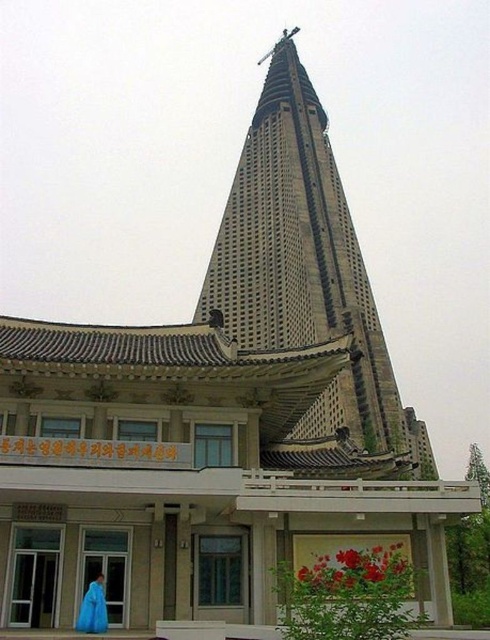
You are an architect visiting the site and see the gray concrete tower at center and the blue fabric at lower left. Which object is placed higher in the image?

The gray concrete tower at center is positioned over the blue fabric at lower left, so it is higher.

You are standing at the entrance of the building and want to locate the gray concrete tower at center. According to the coordinates provided, where should you look relative to your position?

The gray concrete tower at center is located at coordinates point (305, 266), which means it is positioned slightly to the right and below your current viewpoint.